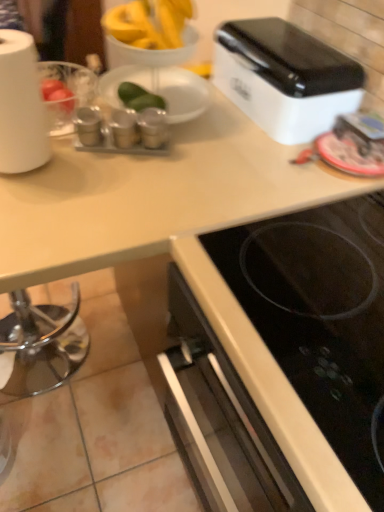
Question: From a real-world perspective, is white glossy toaster at upper right physically located above or below metallic silver spice containers at center, which appears as the first appliance when viewed from the right?

Choices:
 (A) below
 (B) above

Answer: (B)

Question: Choose the correct answer: Is white glossy toaster at upper right inside metallic silver spice containers at center, which ranks as the third appliance in left-to-right order, or outside it?

Choices:
 (A) outside
 (B) inside

Answer: (A)

Question: Estimate the real-world distances between objects in this image. Which object is closer to the white matte paper towel at left?

Choices:
 (A) black glass cooktop at lower right
 (B) white glossy toaster at upper right
 (C) metallic silver canisters at upper left, which is the 3th appliance in right-to-left order
 (D) metallic silver spice containers at center, which appears as the first appliance when viewed from the right
 (E) metallic silver spice containers at center, which appears as the 2th appliance when viewed from the right

Answer: (C)

Question: Estimate the real-world distances between objects in this image. Which object is farther from the white glossy toaster at upper right?

Choices:
 (A) black glass cooktop at lower right
 (B) metallic silver spice containers at center, which appears as the first appliance when viewed from the right
 (C) metallic silver canisters at upper left, which is the 3th appliance in right-to-left order
 (D) metallic silver spice containers at center, acting as the second appliance starting from the left
 (E) white matte paper towel at left

Answer: (E)